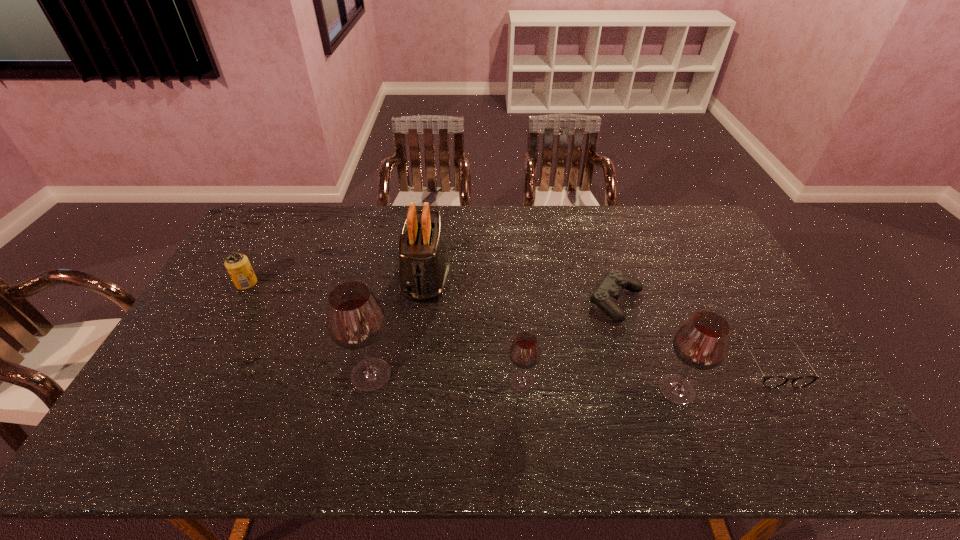
Locate an element on the screen. Image resolution: width=960 pixels, height=540 pixels. vacant space at the far edge is located at coordinates (492, 227).

In order to click on vacant space at the near edge of the desktop in this screenshot , I will do `click(541, 408)`.

You are a GUI agent. You are given a task and a screenshot of the screen. Output one action in this format:
    pyautogui.click(x=<x>, y=<y>)
    Task: Click on the free space at the left edge
    Image resolution: width=960 pixels, height=540 pixels.
    Given the screenshot: What is the action you would take?
    pyautogui.click(x=195, y=343)

Locate an element on the screen. The width and height of the screenshot is (960, 540). free space at the right edge of the desktop is located at coordinates (740, 319).

Identify the location of vacant position at the far left corner of the desktop. (263, 229).

Find the location of `vacant area that lies between the toaster and the rightmost wineglass`. vacant area that lies between the toaster and the rightmost wineglass is located at coordinates (551, 333).

Find the location of `free spot between the leftmost object and the toaster`. free spot between the leftmost object and the toaster is located at coordinates (336, 280).

At what (x,y) coordinates should I click in order to perform the action: click on vacant point located between the leftmost wineglass and the toaster. Please return your answer as a coordinate pair (x, y). Image resolution: width=960 pixels, height=540 pixels. Looking at the image, I should click on (398, 326).

You are a GUI agent. You are given a task and a screenshot of the screen. Output one action in this format:
    pyautogui.click(x=<x>, y=<y>)
    Task: Click on the vacant region between the second shortest object and the shortest wineglass
    The height and width of the screenshot is (540, 960).
    Given the screenshot: What is the action you would take?
    pyautogui.click(x=569, y=342)

Find the location of a particular element. This screenshot has height=540, width=960. vacant space that is in between the toaster and the second wineglass from left to right is located at coordinates (473, 329).